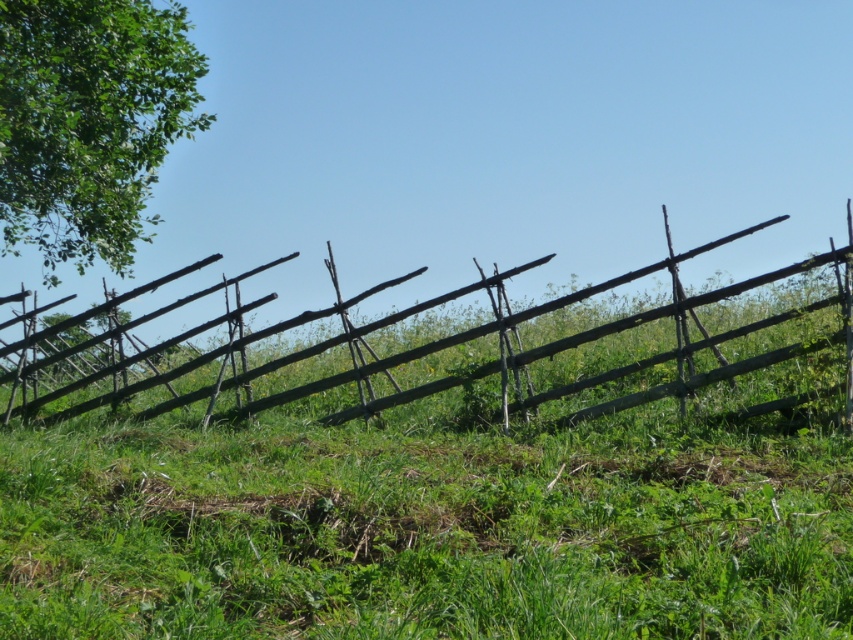
Which of these two, green leafy tree at upper left or rustic wooden fence at center, stands taller?

With more height is green leafy tree at upper left.

Who is positioned more to the left, green leafy tree at upper left or rustic wooden fence at center?

From the viewer's perspective, green leafy tree at upper left appears more on the left side.

This screenshot has height=640, width=853. In order to click on green leafy tree at upper left in this screenshot , I will do `click(90, 122)`.

Locate an element on the screen. green leafy tree at upper left is located at coordinates (90, 122).